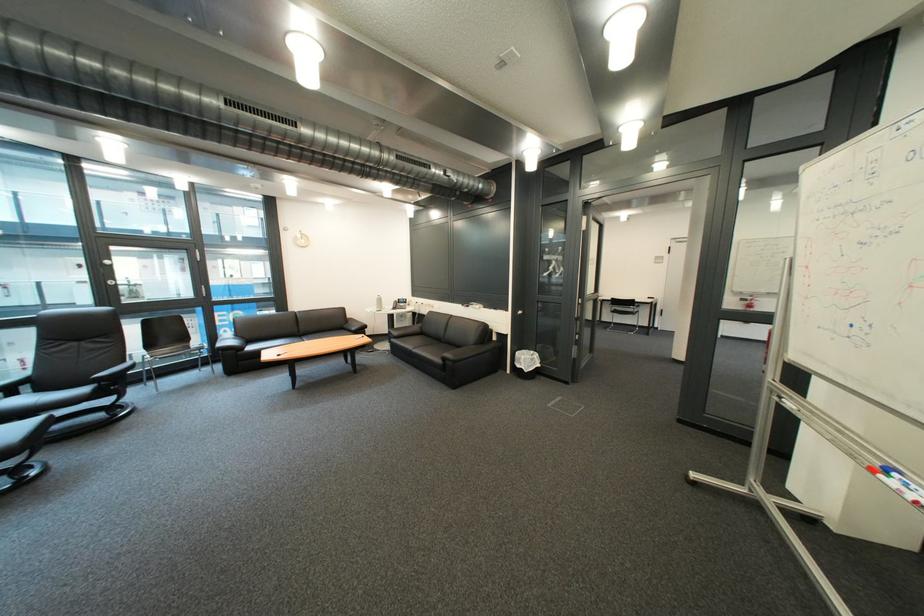
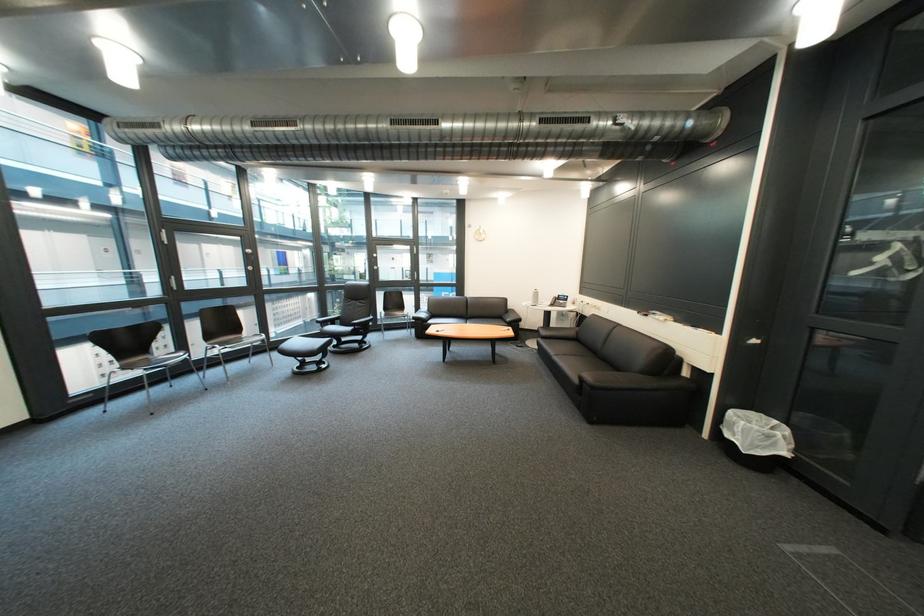
In the second image, find the point that corresponds to point 108,391 in the first image.

(366, 331)